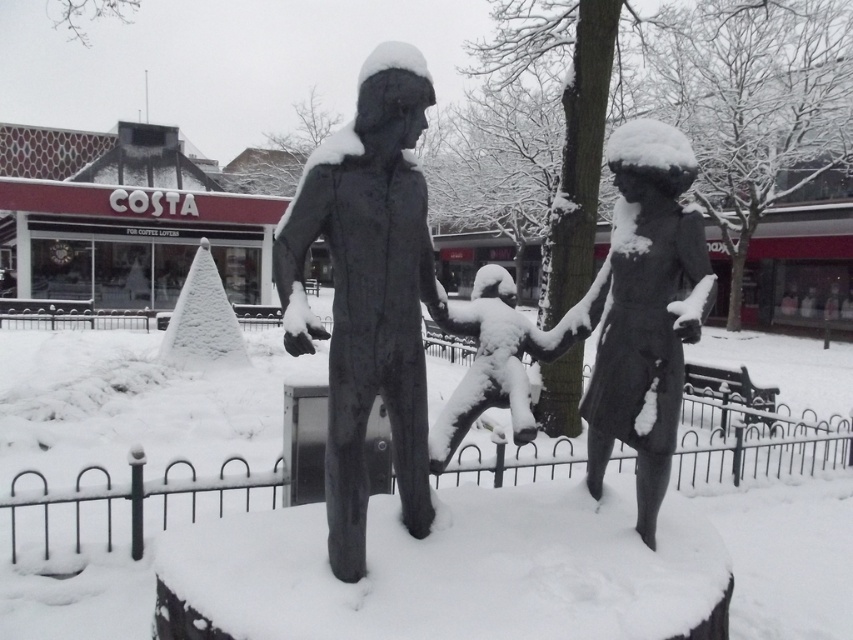
How far apart are bronze statue at center and white snow-covered statue at center?

bronze statue at center and white snow-covered statue at center are 21.90 inches apart from each other.

Consider the image. Between bronze statue at center and white snow-covered statue at center, which one is positioned higher?

bronze statue at center

What do you see at coordinates (641, 310) in the screenshot? I see `bronze statue at center` at bounding box center [641, 310].

The height and width of the screenshot is (640, 853). Identify the location of bronze statue at center. (641, 310).

Who is positioned more to the right, matte bronze statue at center or white snow-covered statue at center?

white snow-covered statue at center

Can you confirm if matte bronze statue at center is positioned below white snow-covered statue at center?

Incorrect, matte bronze statue at center is not positioned below white snow-covered statue at center.

Who is more forward, (376, 225) or (428, 435)?

Positioned in front is point (376, 225).

Where is `matte bronze statue at center`? matte bronze statue at center is located at coordinates (368, 291).

Who is positioned more to the right, matte bronze statue at center or bronze statue at center?

Positioned to the right is bronze statue at center.

Can you confirm if matte bronze statue at center is thinner than bronze statue at center?

Yes.

Is point (328, 550) farther from viewer compared to point (663, 209)?

No.

I want to click on matte bronze statue at center, so click(x=368, y=291).